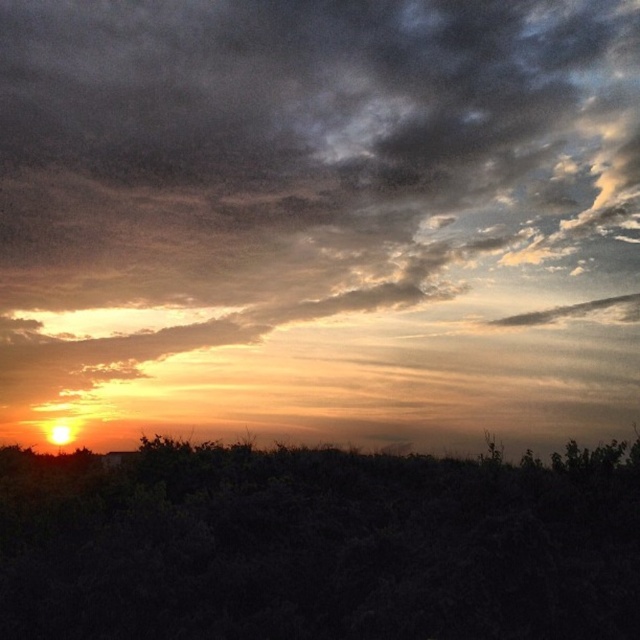
Measure the distance from cloudy sky at upper center to orange matte horizon at lower center.

They are 15.02 feet apart.

This screenshot has width=640, height=640. I want to click on cloudy sky at upper center, so click(x=317, y=220).

You are a GUI agent. You are given a task and a screenshot of the screen. Output one action in this format:
    pyautogui.click(x=<x>, y=<y>)
    Task: Click on the cloudy sky at upper center
    The image size is (640, 640).
    Given the screenshot: What is the action you would take?
    pyautogui.click(x=317, y=220)